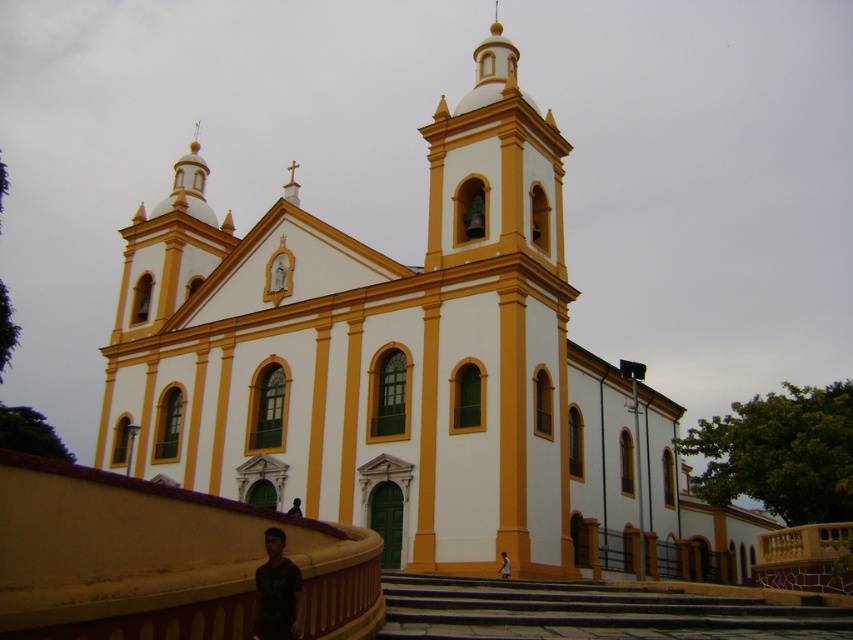
Question: Does white smooth church at center appear on the left side of dark gray stone stairs at lower center?

Choices:
 (A) yes
 (B) no

Answer: (A)

Question: Based on their relative distances, which object is farther from the light brown skin at lower center?

Choices:
 (A) white smooth church at center
 (B) black matte shirt at lower center
 (C) black matte man at lower center

Answer: (A)

Question: Which object is closer to the camera taking this photo?

Choices:
 (A) dark gray stone stairs at lower center
 (B) black matte shirt at lower center

Answer: (B)

Question: Can you confirm if black matte shirt at lower center is thinner than black matte man at lower center?

Choices:
 (A) no
 (B) yes

Answer: (A)

Question: Where is black matte shirt at lower center located in relation to black matte man at lower center in the image?

Choices:
 (A) below
 (B) above

Answer: (B)

Question: Which object appears farthest from the camera in this image?

Choices:
 (A) black matte shirt at lower center
 (B) black matte man at lower center
 (C) dark gray stone stairs at lower center
 (D) light brown skin at lower center

Answer: (B)